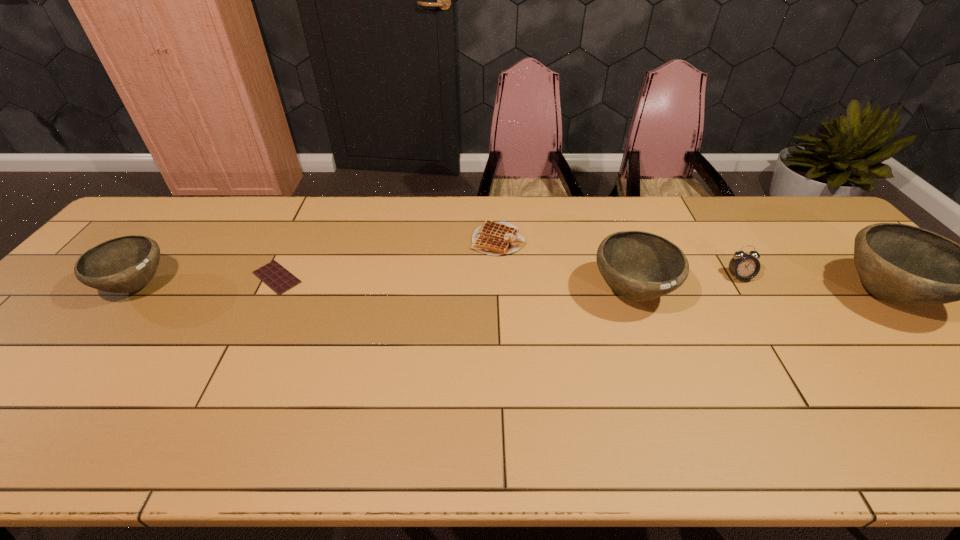
Where is `vacant space at the right edge of the desktop`? The width and height of the screenshot is (960, 540). vacant space at the right edge of the desktop is located at coordinates (885, 334).

In the image, there is a desktop. At what (x,y) coordinates should I click in order to perform the action: click on vacant area at the far left corner. Please return your answer as a coordinate pair (x, y). Looking at the image, I should click on (147, 206).

The width and height of the screenshot is (960, 540). What are the coordinates of `free spot between the fourth object from left to right and the chocolate bar` in the screenshot? It's located at coord(454,285).

Identify the location of vacant area that lies between the third object from right to left and the shortest bowl. (384, 289).

What are the coordinates of `free space that is in between the alarm clock and the leftmost object` in the screenshot? It's located at (438, 281).

You are a GUI agent. You are given a task and a screenshot of the screen. Output one action in this format:
    pyautogui.click(x=<x>, y=<y>)
    Task: Click on the free space between the shortest bowl and the alarm clock
    
    Given the screenshot: What is the action you would take?
    coord(438,281)

In order to click on free area in between the second bowl from right to left and the third tallest object in this screenshot , I will do `click(384, 289)`.

Find the location of a particular element. This screenshot has width=960, height=540. free space between the shortest object and the leftmost object is located at coordinates (207, 282).

Identify which object is located as the fourth nearest to the rightmost object. Please provide its 2D coordinates. Your answer should be formatted as a tuple, i.e. [(x, y)], where the tuple contains the x and y coordinates of a point satisfying the conditions above.

[(275, 276)]

Identify which object is the nearest to the shortest bowl. Please provide its 2D coordinates. Your answer should be formatted as a tuple, i.e. [(x, y)], where the tuple contains the x and y coordinates of a point satisfying the conditions above.

[(275, 276)]